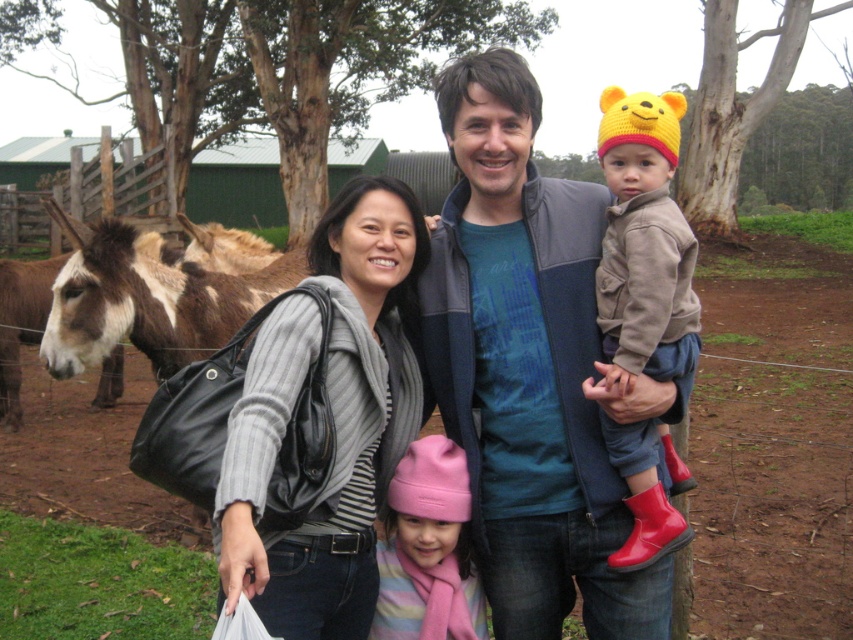
Looking at the family photo, both the gray woolen sweater at center and the pink fleece hat at center are visible. Which one is positioned to the left?

The gray woolen sweater at center is to the left of the pink fleece hat at center.

You are trying to decide which clothing item to grab quickly from the ground. You see the blue fleece jacket at center and the gray woolen sweater at center. Which one is easier to reach?

The blue fleece jacket at center is above gray woolen sweater at center, so it is easier to reach since it is higher up.